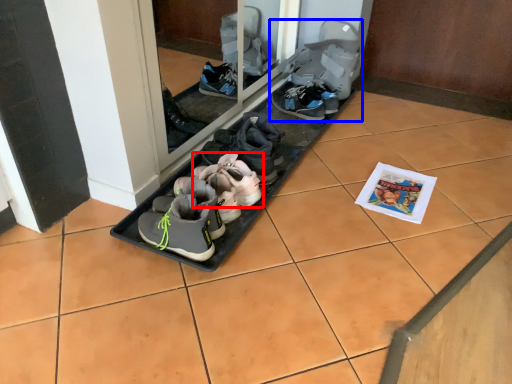
Question: Among these objects, which one is farthest to the camera, footwear (highlighted by a red box) or footwear (highlighted by a blue box)?

Choices:
 (A) footwear
 (B) footwear

Answer: (B)